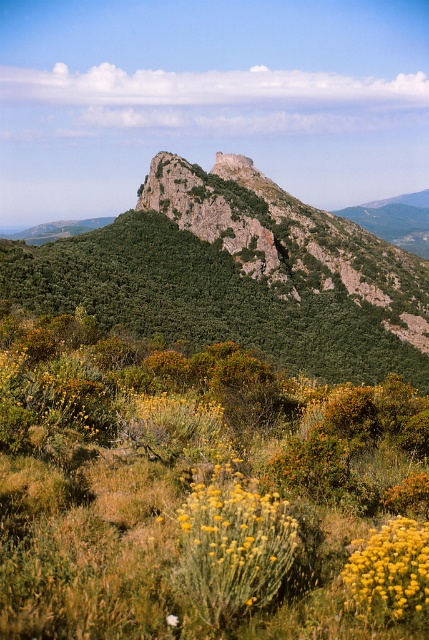
Question: Which of the following is the closest to the observer?

Choices:
 (A) (402, 573)
 (B) (389, 268)

Answer: (A)

Question: Does green rocky mountain at upper center have a smaller size compared to yellow fluffy bush at lower center?

Choices:
 (A) no
 (B) yes

Answer: (A)

Question: Does green rocky mountain at upper center appear over yellow fluffy bush at lower center?

Choices:
 (A) no
 (B) yes

Answer: (B)

Question: Can you confirm if green rocky mountain at upper center is positioned to the left of yellow fluffy bush at lower center?

Choices:
 (A) yes
 (B) no

Answer: (B)

Question: Which point is closer to the camera?

Choices:
 (A) (396, 518)
 (B) (126, 220)

Answer: (A)

Question: Among these points, which one is farthest from the camera?

Choices:
 (A) (410, 572)
 (B) (157, 284)

Answer: (B)